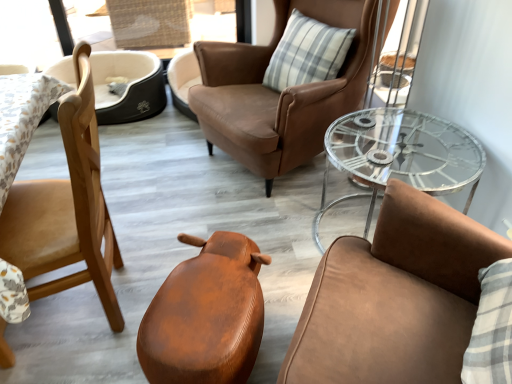
Question: Considering the positions of point (346, 29) and point (7, 347), is point (346, 29) closer or farther from the camera than point (7, 347)?

Choices:
 (A) farther
 (B) closer

Answer: (A)

Question: In the image, is plaid fabric pillow at center on the left side or the right side of light brown wood chair at left, which ranks as the fourth chair in right-to-left order?

Choices:
 (A) left
 (B) right

Answer: (B)

Question: Which object is positioned farthest from the leather chair at center, acting as the 5th chair starting from the left?

Choices:
 (A) leather-like brown stool at center, acting as the third chair starting from the right
 (B) transparent glass table at right
 (C) wooden chair at left, arranged as the fifth chair when viewed from the right
 (D) brown leather chair at center, arranged as the second chair when viewed from the right
 (E) plaid fabric pillow at center

Answer: (C)

Question: Estimate the real-world distances between objects in this image. Which object is farther from the leather chair at center, arranged as the first chair when viewed from the right?

Choices:
 (A) leather-like brown stool at center, acting as the third chair starting from the right
 (B) plaid fabric pillow at center
 (C) transparent glass table at right
 (D) wooden chair at left, arranged as the fifth chair when viewed from the right
 (E) brown leather chair at center, which ranks as the 4th chair in left-to-right order

Answer: (D)